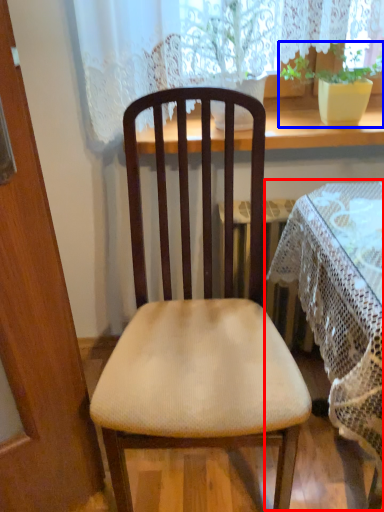
Question: Which object appears farthest to the camera in this image, table (highlighted by a red box) or houseplant (highlighted by a blue box)?

Choices:
 (A) table
 (B) houseplant

Answer: (B)